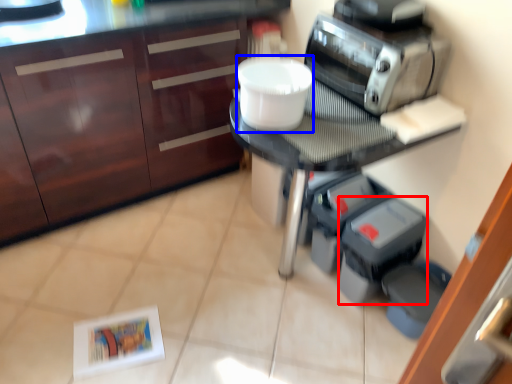
Question: Among these objects, which one is farthest to the camera, appliance (highlighted by a red box) or toilet bowl (highlighted by a blue box)?

Choices:
 (A) appliance
 (B) toilet bowl

Answer: (A)